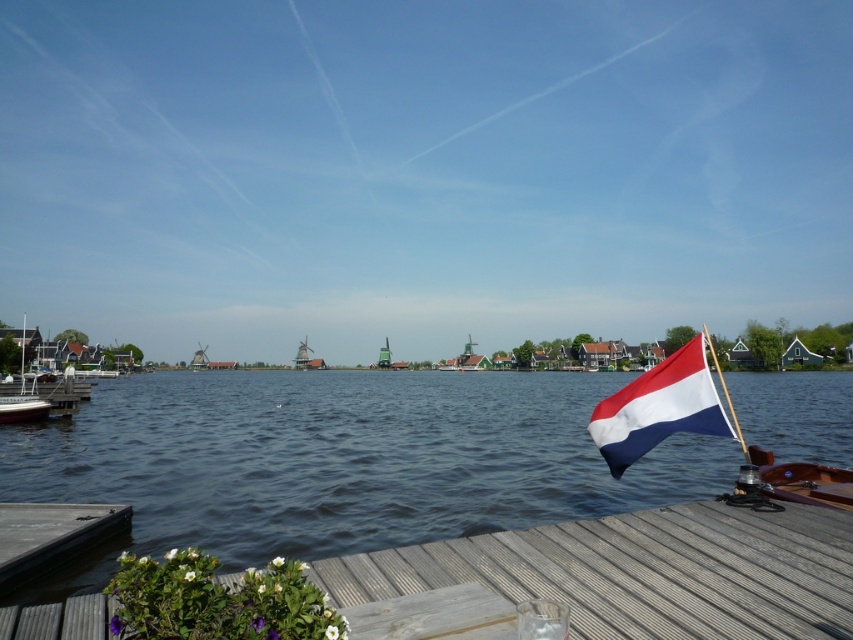
Does red-white-blue fabric flag at right appear on the left side of white wooden boat at left?

Incorrect, red-white-blue fabric flag at right is not on the left side of white wooden boat at left.

Between red-white-blue fabric flag at right and white wooden boat at left, which one appears on the right side from the viewer's perspective?

red-white-blue fabric flag at right is more to the right.

Between point (706, 365) and point (10, 397), which one is positioned behind?

Point (10, 397)

This screenshot has height=640, width=853. I want to click on red-white-blue fabric flag at right, so click(x=659, y=408).

Which is more to the left, wooden dock at lower center or wooden dock at lower left?

From the viewer's perspective, wooden dock at lower left appears more on the left side.

Can you confirm if wooden dock at lower center is taller than wooden dock at lower left?

In fact, wooden dock at lower center may be shorter than wooden dock at lower left.

Does point (836, 554) come in front of point (10, 528)?

That is True.

Where is `wooden dock at lower center`? This screenshot has height=640, width=853. wooden dock at lower center is located at coordinates (640, 572).

Can you confirm if transparent water at lower center is shorter than wooden dock at lower left?

No, transparent water at lower center is not shorter than wooden dock at lower left.

Measure the distance between transparent water at lower center and camera.

They are 6.26 meters apart.

Find the location of a particular element. The image size is (853, 640). transparent water at lower center is located at coordinates (335, 461).